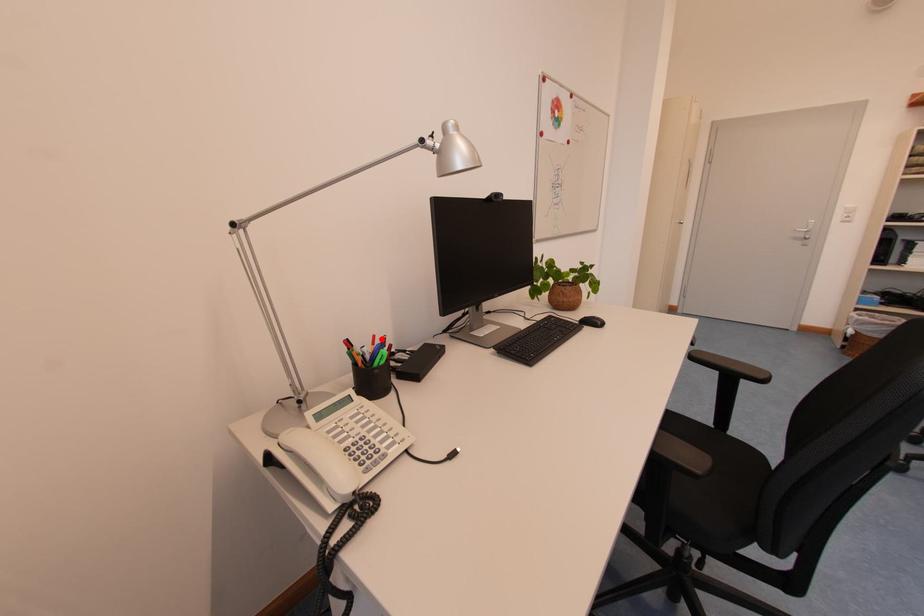
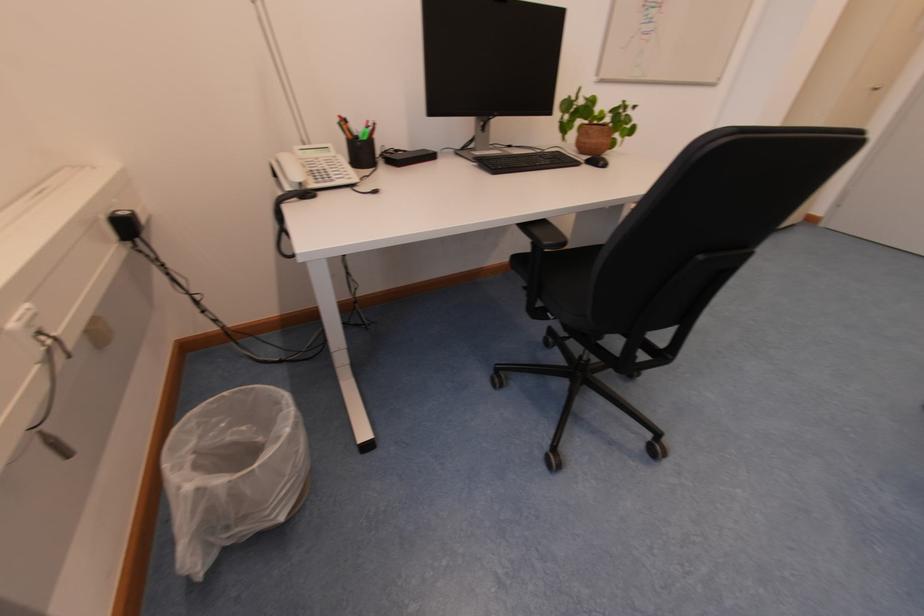
Where in the second image is the point corresponding to the highlighted location from the first image?

(375, 124)